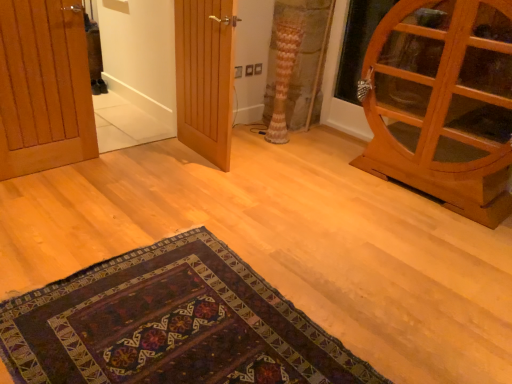
This screenshot has width=512, height=384. Find the location of `free space to the right of wooden door at center, the second door in the right-to-left sequence`. free space to the right of wooden door at center, the second door in the right-to-left sequence is located at coordinates pyautogui.click(x=254, y=162).